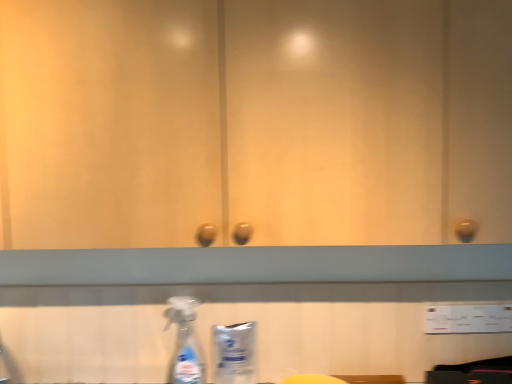
Locate an element on the screen. The width and height of the screenshot is (512, 384). yellow matte sponge at lower center is located at coordinates 312,379.

This screenshot has height=384, width=512. I want to click on yellow matte sponge at lower center, so [x=312, y=379].

Based on the photo, is white plastic bottle at lower center inside the boundaries of yellow matte sponge at lower center, or outside?

white plastic bottle at lower center is not inside yellow matte sponge at lower center, it's outside.

Is white plastic bottle at lower center wider or thinner than yellow matte sponge at lower center?

Clearly, white plastic bottle at lower center has less width compared to yellow matte sponge at lower center.

From a real-world perspective, is white plastic bottle at lower center positioned over yellow matte sponge at lower center based on gravity?

Yes, from a real-world perspective, white plastic bottle at lower center is above yellow matte sponge at lower center.

From the image's perspective, is white plastic bottle at lower center on top of transparent plastic spray bottle at lower left?

No, from the image's perspective, white plastic bottle at lower center is not above transparent plastic spray bottle at lower left.

Is point (216, 382) closer to viewer compared to point (176, 317)?

That is True.

Does white plastic bottle at lower center lie behind transparent plastic spray bottle at lower left?

Yes, the depth of white plastic bottle at lower center is greater than that of transparent plastic spray bottle at lower left.

Does white plastic bottle at lower center have a lesser width compared to transparent plastic spray bottle at lower left?

Indeed, white plastic bottle at lower center has a lesser width compared to transparent plastic spray bottle at lower left.

Is yellow matte sponge at lower center behind transparent plastic spray bottle at lower left?

No, it is not.

Can you confirm if yellow matte sponge at lower center is shorter than transparent plastic spray bottle at lower left?

Indeed, yellow matte sponge at lower center has a lesser height compared to transparent plastic spray bottle at lower left.

Is yellow matte sponge at lower center beside transparent plastic spray bottle at lower left?

No, yellow matte sponge at lower center is not touching transparent plastic spray bottle at lower left.

Which point is more forward, (189, 356) or (315, 376)?

The point (315, 376) is in front.

Considering the relative sizes of transparent plastic spray bottle at lower left and yellow matte sponge at lower center in the image provided, is transparent plastic spray bottle at lower left shorter than yellow matte sponge at lower center?

Incorrect, the height of transparent plastic spray bottle at lower left does not fall short of that of yellow matte sponge at lower center.

In the image, is transparent plastic spray bottle at lower left positioned in front of or behind yellow matte sponge at lower center?

Visually, transparent plastic spray bottle at lower left is located behind yellow matte sponge at lower center.

From the picture: From a real-world perspective, which object rests below the other?

In real-world perspective, yellow matte sponge at lower center is lower.

From the picture: Considering the sizes of objects yellow matte sponge at lower center and white plastic bottle at lower center in the image provided, who is bigger, yellow matte sponge at lower center or white plastic bottle at lower center?

With larger size is yellow matte sponge at lower center.

Where is `cleaning product above the yellow matte sponge at lower center (from the image's perspective)`? cleaning product above the yellow matte sponge at lower center (from the image's perspective) is located at coordinates (234, 353).

The image size is (512, 384). I want to click on bottle above the white plastic bottle at lower center (from the image's perspective), so click(x=185, y=342).

Which is more to the left, transparent plastic spray bottle at lower left or white plastic bottle at lower center?

transparent plastic spray bottle at lower left.

From the image's perspective, between transparent plastic spray bottle at lower left and white plastic bottle at lower center, which one is located above?

From the image's view, transparent plastic spray bottle at lower left is above.

Find the location of a particular element. The width and height of the screenshot is (512, 384). wide that is in front of the white plastic bottle at lower center is located at coordinates (312, 379).

Locate an element on the screen. The image size is (512, 384). cleaning product behind the transparent plastic spray bottle at lower left is located at coordinates (234, 353).

Estimate the real-world distances between objects in this image. Which object is closer to white plastic bottle at lower center, transparent plastic spray bottle at lower left or yellow matte sponge at lower center?

Based on the image, transparent plastic spray bottle at lower left appears to be nearer to white plastic bottle at lower center.

Estimate the real-world distances between objects in this image. Which object is closer to transparent plastic spray bottle at lower left, white plastic bottle at lower center or yellow matte sponge at lower center?

white plastic bottle at lower center lies closer to transparent plastic spray bottle at lower left than the other object.

From the picture: Estimate the real-world distances between objects in this image. Which object is further from yellow matte sponge at lower center, transparent plastic spray bottle at lower left or white plastic bottle at lower center?

Among the two, transparent plastic spray bottle at lower left is located further to yellow matte sponge at lower center.

Which object lies nearer to the anchor point yellow matte sponge at lower center, white plastic bottle at lower center or transparent plastic spray bottle at lower left?

white plastic bottle at lower center is closer to yellow matte sponge at lower center.

Estimate the real-world distances between objects in this image. Which object is further from transparent plastic spray bottle at lower left, yellow matte sponge at lower center or white plastic bottle at lower center?

The object further to transparent plastic spray bottle at lower left is yellow matte sponge at lower center.

Looking at the image, which one is located closer to white plastic bottle at lower center, yellow matte sponge at lower center or transparent plastic spray bottle at lower left?

Among the two, transparent plastic spray bottle at lower left is located nearer to white plastic bottle at lower center.

You are a GUI agent. You are given a task and a screenshot of the screen. Output one action in this format:
    pyautogui.click(x=<x>, y=<y>)
    Task: Click on the bottle positioned between yellow matte sponge at lower center and white plastic bottle at lower center from near to far
    This screenshot has width=512, height=384.
    Given the screenshot: What is the action you would take?
    pyautogui.click(x=185, y=342)